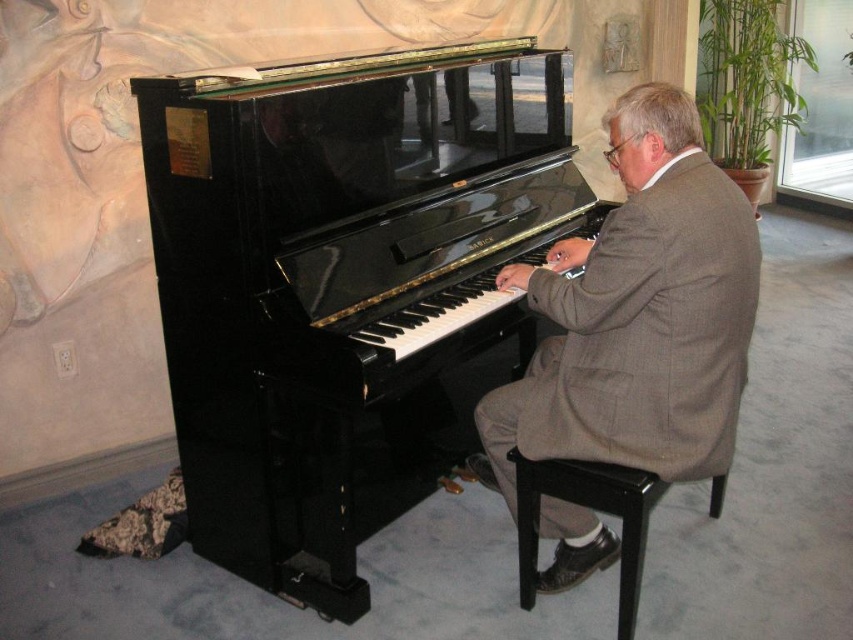
You are a photographer setting up for a portrait. You need to ensure that both the black polished piano at center and the gray wool suit at center are in focus. Given that the piano is larger than the suit, which object should you adjust your camera focus on first to ensure proper depth of field?

Since the black polished piano at center is larger than the gray wool suit at center, you should focus on the black polished piano at center first to ensure the depth of field captures both objects clearly.

You are a photographer setting up for a portrait session. You notice the gray wool suit at center and the black wood stool at lower center. Which object is covering the other one in the image?

The gray wool suit at center is positioned over the black wood stool at lower center, so it is covering the stool.